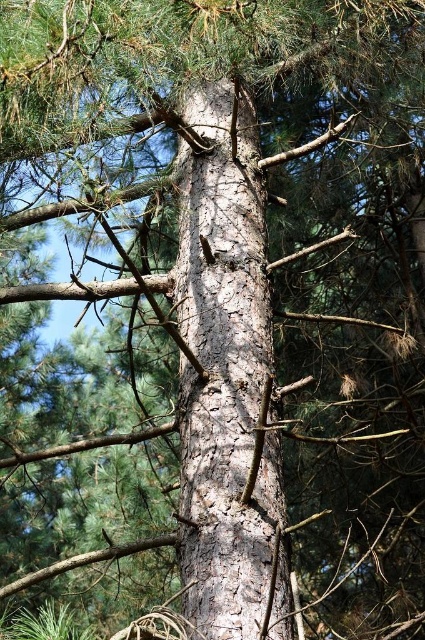
Is point (169, 536) behind point (78, 445)?

No.

Which is above, brown rough branch at lower left or brown rough branch at upper left?

brown rough branch at upper left

Who is more distant from viewer, (70,557) or (5,467)?

The point (5,467) is more distant.

Locate an element on the screen. This screenshot has height=640, width=425. brown rough branch at lower left is located at coordinates (85, 561).